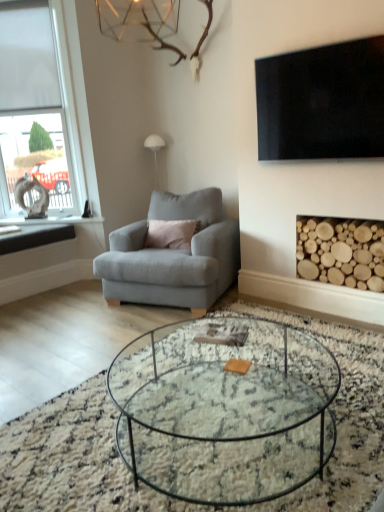
You are a GUI agent. You are given a task and a screenshot of the screen. Output one action in this format:
    pyautogui.click(x=<x>, y=<y>)
    Task: Click on the vacant space underneath clear glass coffee table at center (from a real-world perspective)
    The image size is (384, 512).
    Given the screenshot: What is the action you would take?
    pyautogui.click(x=226, y=457)